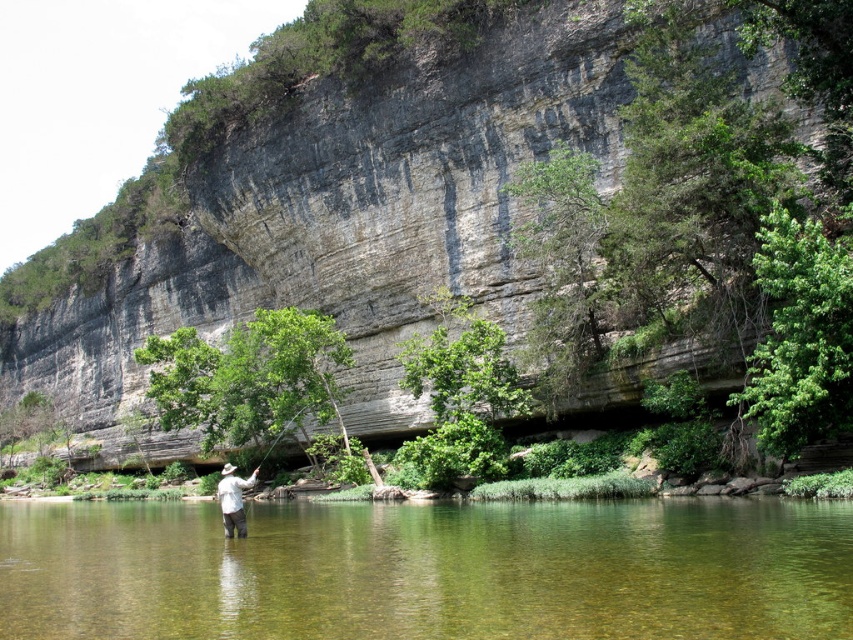
Question: Is gray rock cliff at upper center wider than white matte shirt at center?

Choices:
 (A) yes
 (B) no

Answer: (A)

Question: Which object is the closest to the white matte shirt at center?

Choices:
 (A) gray rock cliff at upper center
 (B) clear water at center

Answer: (B)

Question: Is clear water at center bigger than white matte shirt at center?

Choices:
 (A) no
 (B) yes

Answer: (B)

Question: Does gray rock cliff at upper center appear on the left side of white matte shirt at center?

Choices:
 (A) yes
 (B) no

Answer: (A)

Question: Which object is positioned closest to the clear water at center?

Choices:
 (A) gray rock cliff at upper center
 (B) white matte shirt at center

Answer: (B)

Question: Which object is closer to the camera taking this photo?

Choices:
 (A) gray rock cliff at upper center
 (B) clear water at center

Answer: (B)